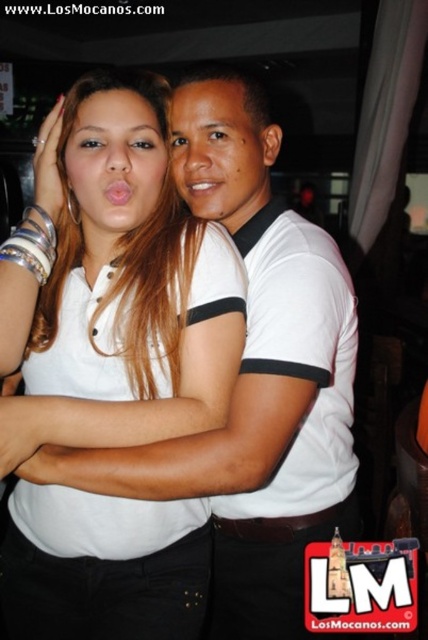
Question: Which of the following is the closest to the observer?

Choices:
 (A) (214, 426)
 (B) (228, 444)

Answer: (B)

Question: Can you confirm if white matte shirt at center is positioned to the right of white cotton shirt at center?

Choices:
 (A) yes
 (B) no

Answer: (B)

Question: Is white matte shirt at center above white cotton shirt at center?

Choices:
 (A) yes
 (B) no

Answer: (A)

Question: Is white matte shirt at center in front of white cotton shirt at center?

Choices:
 (A) no
 (B) yes

Answer: (B)

Question: Which of the following is the closest to the observer?

Choices:
 (A) white cotton shirt at center
 (B) white matte shirt at center

Answer: (B)